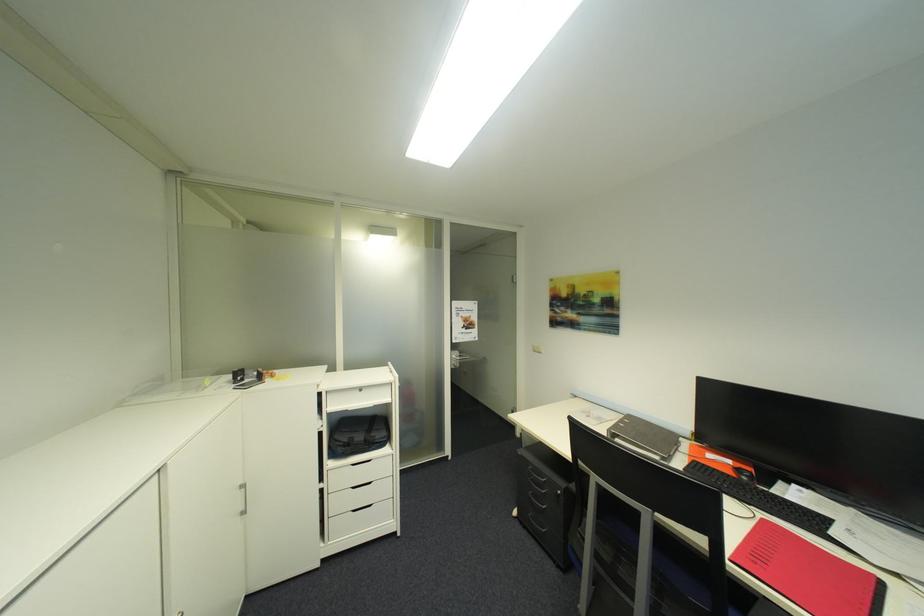
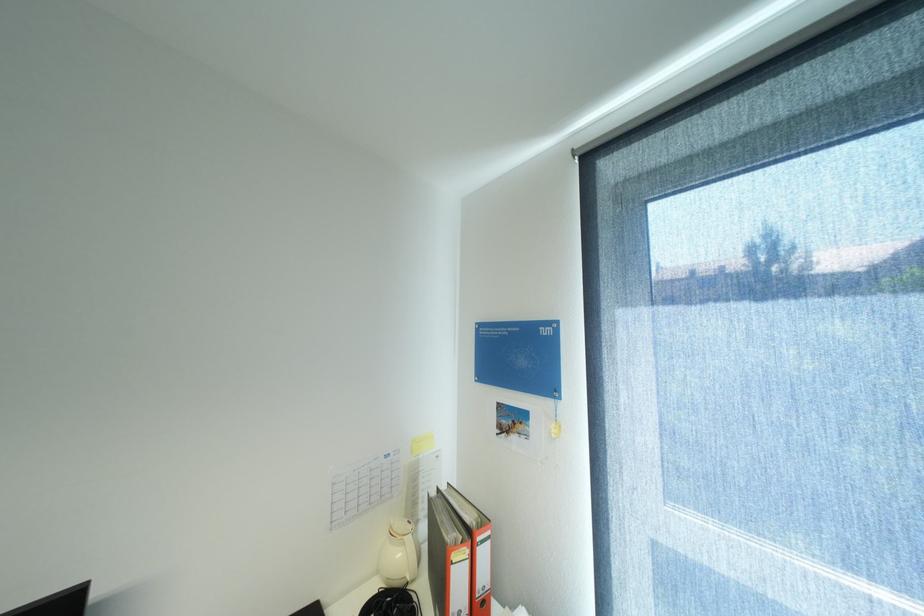
Question: The images are taken continuously from a first-person perspective. In which direction is your viewpoint rotating?

Choices:
 (A) Left
 (B) Right
 (C) Up
 (D) Down

Answer: (B)